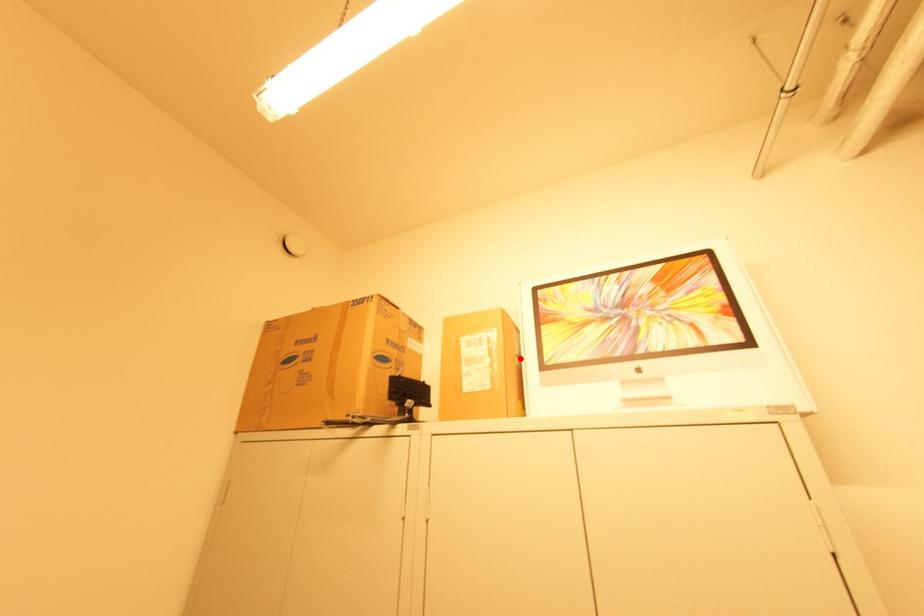
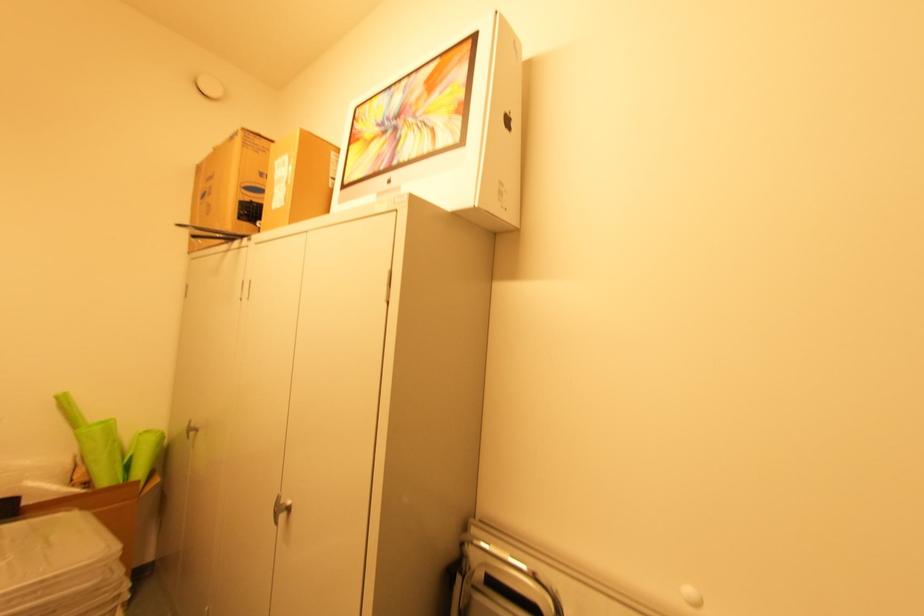
The point at the highlighted location is marked in the first image. Where is the corresponding point in the second image?

(334, 180)